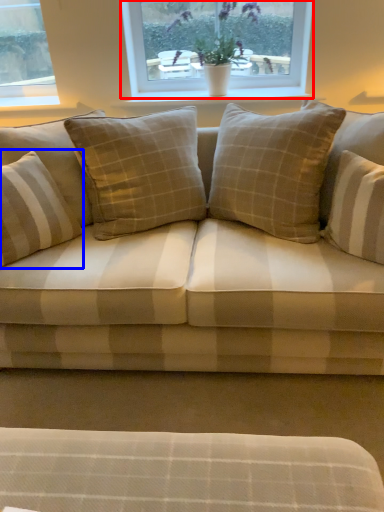
Question: Among these objects, which one is farthest to the camera, window (highlighted by a red box) or pillow (highlighted by a blue box)?

Choices:
 (A) window
 (B) pillow

Answer: (A)